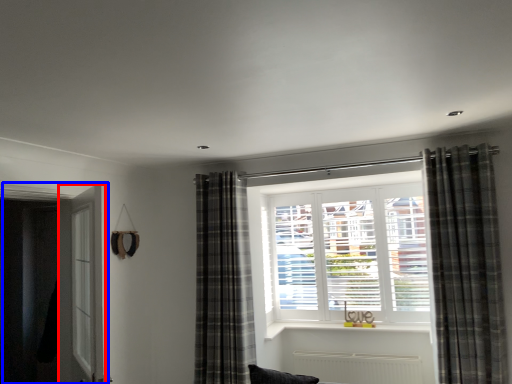
Question: Which object appears closest to the camera in this image, screen door (highlighted by a red box) or door (highlighted by a blue box)?

Choices:
 (A) screen door
 (B) door

Answer: (A)